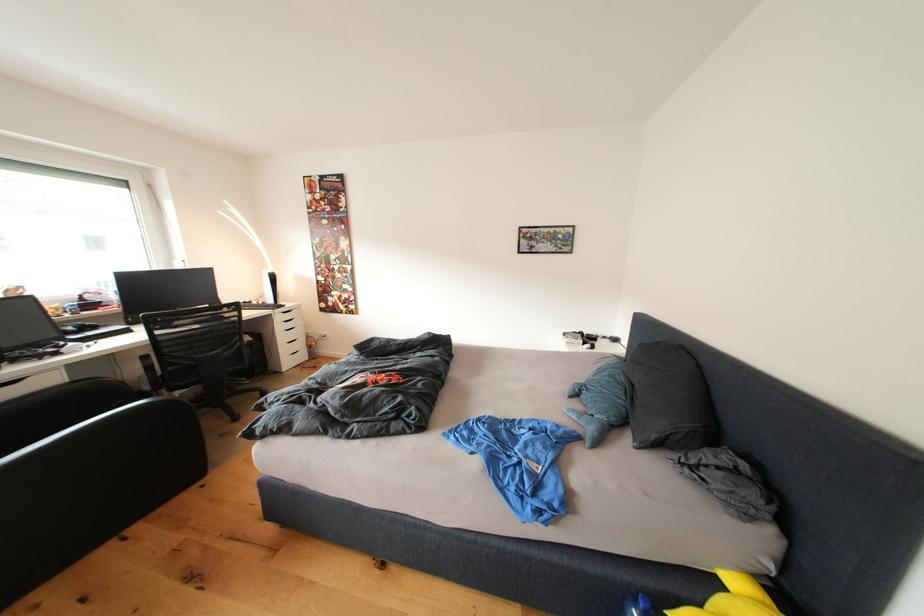
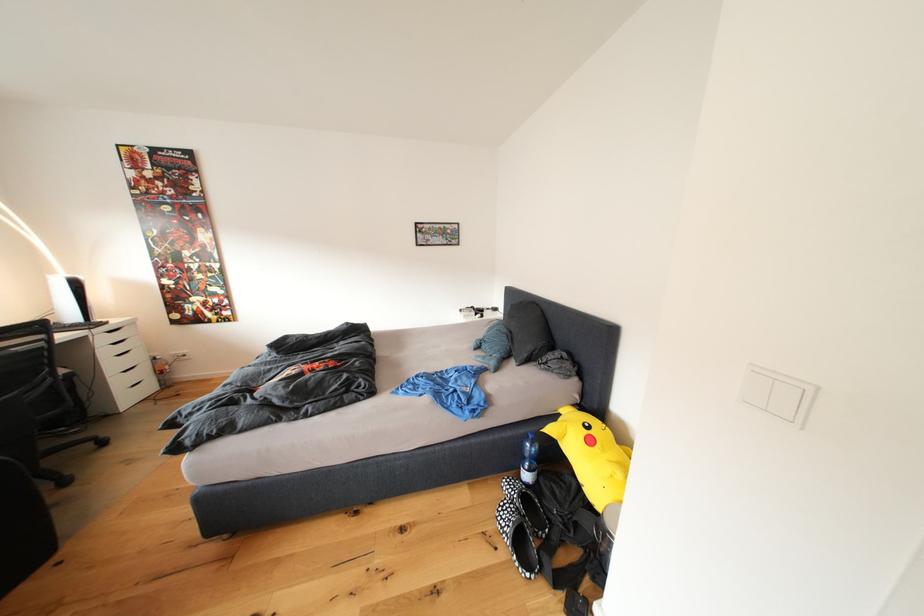
In the second image, find the point that corresponds to point 250,344 in the first image.

(63, 378)